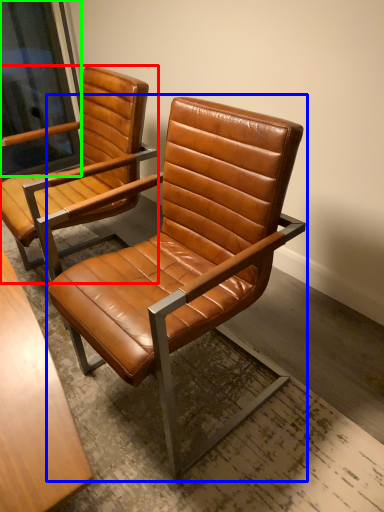
Question: Considering the real-world distances, which object is closest to chair (highlighted by a red box)? chair (highlighted by a blue box) or window screen (highlighted by a green box).

Choices:
 (A) chair
 (B) window screen

Answer: (A)